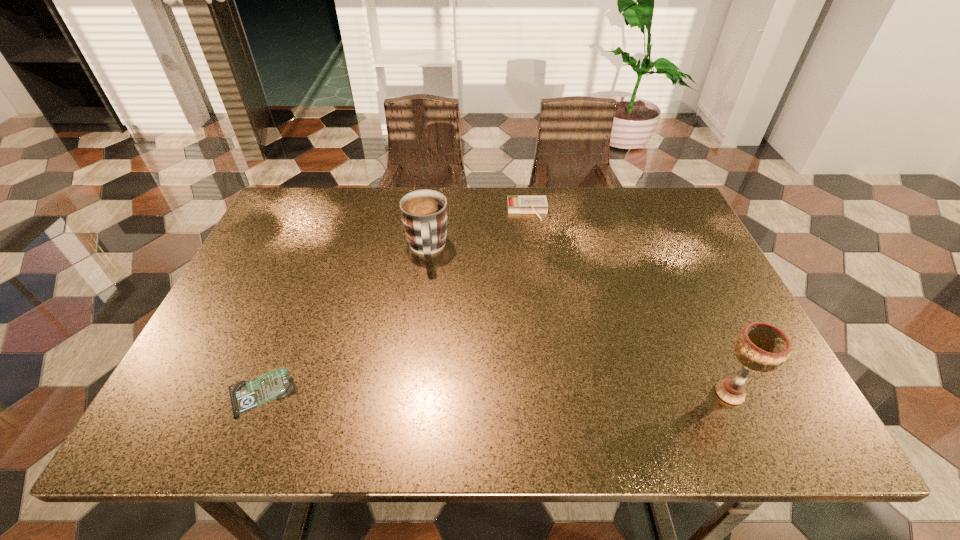
Locate an element on the screen. This screenshot has height=540, width=960. object that is at the left edge is located at coordinates (245, 395).

Image resolution: width=960 pixels, height=540 pixels. In order to click on object that is at the right edge in this screenshot , I will do `click(761, 347)`.

The height and width of the screenshot is (540, 960). I want to click on object located in the near left corner section of the desktop, so click(x=245, y=395).

At what (x,y) coordinates should I click in order to perform the action: click on object that is at the near right corner. Please return your answer as a coordinate pair (x, y). Looking at the image, I should click on (761, 347).

Locate an element on the screen. free spot at the far edge of the desktop is located at coordinates (545, 219).

The image size is (960, 540). Identify the location of vacant space at the near edge of the desktop. [376, 379].

Find the location of `free spot at the left edge of the desktop`. free spot at the left edge of the desktop is located at coordinates (234, 344).

Locate an element on the screen. This screenshot has width=960, height=540. vacant region at the right edge of the desktop is located at coordinates (676, 267).

Locate an element on the screen. Image resolution: width=960 pixels, height=540 pixels. vacant space at the far left corner of the desktop is located at coordinates (313, 200).

What are the coordinates of `vacant space at the near right corner of the desktop` in the screenshot? It's located at (771, 391).